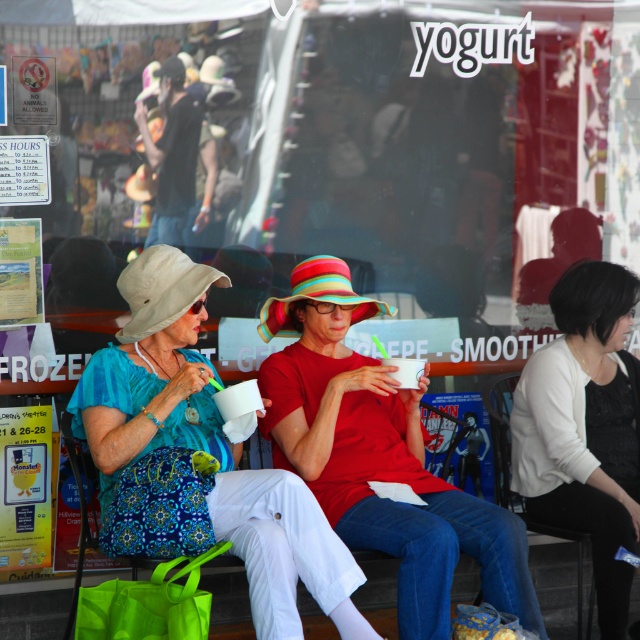
Which is more to the right, matte blue dress at center or white matte sweater at upper right?

From the viewer's perspective, white matte sweater at upper right appears more on the right side.

Does matte blue dress at center have a lesser height compared to white matte sweater at upper right?

Yes, matte blue dress at center is shorter than white matte sweater at upper right.

Locate an element on the screen. matte blue dress at center is located at coordinates (200, 458).

Does matte red shirt at center have a larger size compared to white matte sweater at upper right?

Yes, matte red shirt at center is bigger than white matte sweater at upper right.

Which is in front, point (433, 627) or point (588, 476)?

Positioned in front is point (433, 627).

Where is `matte red shirt at center`? This screenshot has width=640, height=640. matte red shirt at center is located at coordinates click(380, 458).

Does matte blue dress at center have a greater width compared to matte red shirt at center?

Yes, matte blue dress at center is wider than matte red shirt at center.

Consider the image. Is matte blue dress at center in front of matte red shirt at center?

That is True.

Is point (156, 454) in front of point (326, 268)?

Yes, point (156, 454) is in front of point (326, 268).

Image resolution: width=640 pixels, height=640 pixels. I want to click on matte blue dress at center, so click(200, 458).